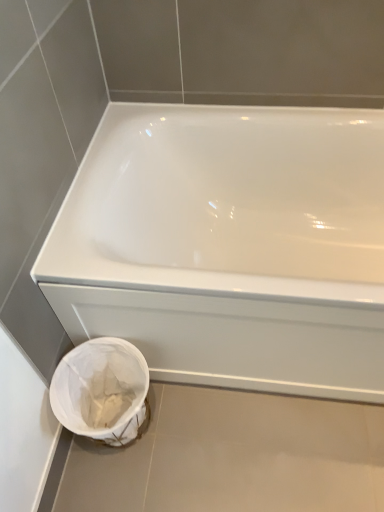
Question: Should I look upward or downward to see white fabric bag at lower left?

Choices:
 (A) up
 (B) down

Answer: (B)

Question: Should I look upward or downward to see white glossy bathtub at center?

Choices:
 (A) down
 (B) up

Answer: (B)

Question: From a real-world perspective, does white glossy bathtub at center sit lower than white fabric bag at lower left?

Choices:
 (A) yes
 (B) no

Answer: (B)

Question: Considering the relative sizes of white glossy bathtub at center and white fabric bag at lower left in the image provided, is white glossy bathtub at center smaller than white fabric bag at lower left?

Choices:
 (A) no
 (B) yes

Answer: (A)

Question: Can you confirm if white glossy bathtub at center is thinner than white fabric bag at lower left?

Choices:
 (A) no
 (B) yes

Answer: (A)

Question: Is white glossy bathtub at center not inside white fabric bag at lower left?

Choices:
 (A) no
 (B) yes

Answer: (B)

Question: Is white glossy bathtub at center positioned in front of white fabric bag at lower left?

Choices:
 (A) no
 (B) yes

Answer: (B)

Question: Could you tell me if white glossy bathtub at center is facing white fabric bag at lower left?

Choices:
 (A) no
 (B) yes

Answer: (B)

Question: Considering the relative sizes of white fabric bag at lower left and white glossy bathtub at center in the image provided, is white fabric bag at lower left thinner than white glossy bathtub at center?

Choices:
 (A) yes
 (B) no

Answer: (A)

Question: Considering the relative positions of white fabric bag at lower left and white glossy bathtub at center in the image provided, is white fabric bag at lower left in front of white glossy bathtub at center?

Choices:
 (A) no
 (B) yes

Answer: (A)

Question: Considering the relative positions of white fabric bag at lower left and white glossy bathtub at center in the image provided, is white fabric bag at lower left behind white glossy bathtub at center?

Choices:
 (A) yes
 (B) no

Answer: (A)

Question: Is white fabric bag at lower left not close to white glossy bathtub at center?

Choices:
 (A) no
 (B) yes

Answer: (A)

Question: Is white fabric bag at lower left shorter than white glossy bathtub at center?

Choices:
 (A) yes
 (B) no

Answer: (A)

Question: Could you tell me if white fabric bag at lower left is turned towards white glossy bathtub at center?

Choices:
 (A) no
 (B) yes

Answer: (A)

Question: Is white glossy bathtub at center taller or shorter than white fabric bag at lower left?

Choices:
 (A) short
 (B) tall

Answer: (B)